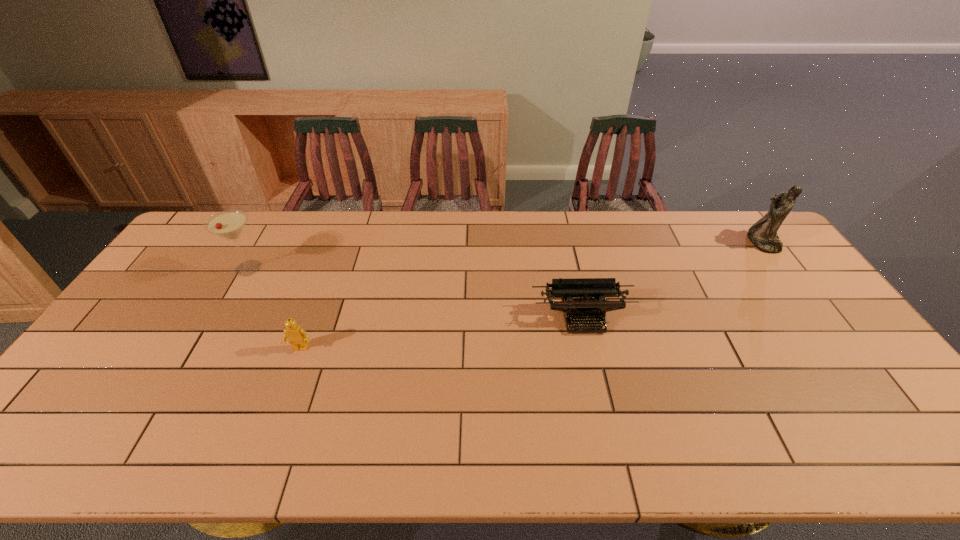
This screenshot has height=540, width=960. Find the location of `vacant space that is in between the rightmost object and the third shortest object`. vacant space that is in between the rightmost object and the third shortest object is located at coordinates 505,255.

Choose which object is the nearest neighbor to the farthest object. Please provide its 2D coordinates. Your answer should be formatted as a tuple, i.e. [(x, y)], where the tuple contains the x and y coordinates of a point satisfying the conditions above.

[(569, 290)]

Where is `object that stands as the closest to the third object from left to right`? object that stands as the closest to the third object from left to right is located at coordinates (763, 234).

Where is `vacant region that satisfies the following two spatial constraints: 1. on the front-facing side of the rightmost object; 2. on the face of the nearest object`? The width and height of the screenshot is (960, 540). vacant region that satisfies the following two spatial constraints: 1. on the front-facing side of the rightmost object; 2. on the face of the nearest object is located at coordinates tap(842, 348).

Where is `free space that satisfies the following two spatial constraints: 1. on the front-facing side of the figurine; 2. on the typing side of the third farthest object`? free space that satisfies the following two spatial constraints: 1. on the front-facing side of the figurine; 2. on the typing side of the third farthest object is located at coordinates pyautogui.click(x=819, y=318).

This screenshot has height=540, width=960. Find the location of `free region that satisfies the following two spatial constraints: 1. on the front-facing side of the farthest object; 2. on the face of the Lego`. free region that satisfies the following two spatial constraints: 1. on the front-facing side of the farthest object; 2. on the face of the Lego is located at coordinates (842, 348).